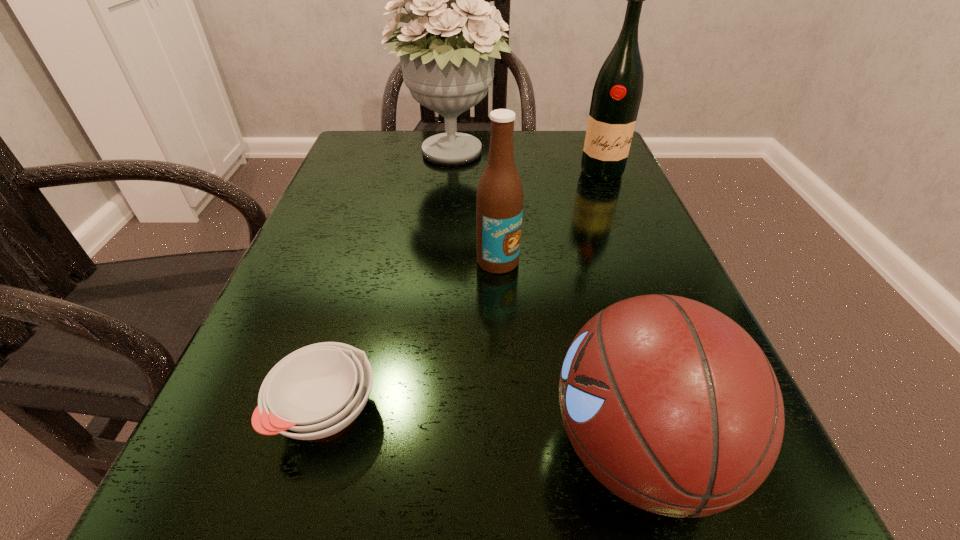
What are the coordinates of `liquor that is at the far edge` in the screenshot? It's located at (617, 93).

Locate an element on the screen. This screenshot has height=540, width=960. bouquet situated at the left edge is located at coordinates (448, 70).

In order to click on soup bowl at the left edge in this screenshot , I will do `click(316, 391)`.

Find the location of `object present at the right edge`. object present at the right edge is located at coordinates (617, 93).

Where is `object that is at the far left corner`? The image size is (960, 540). object that is at the far left corner is located at coordinates (448, 70).

Find the location of a particular element. object present at the far right corner is located at coordinates (617, 93).

This screenshot has width=960, height=540. What are the coordinates of `vacant space at the far edge` in the screenshot? It's located at (521, 143).

Locate an element on the screen. The image size is (960, 540). free space at the near edge of the desktop is located at coordinates point(603,531).

Identify the location of free space at the left edge of the desktop. (346, 232).

I want to click on vacant area at the right edge, so coord(621,213).